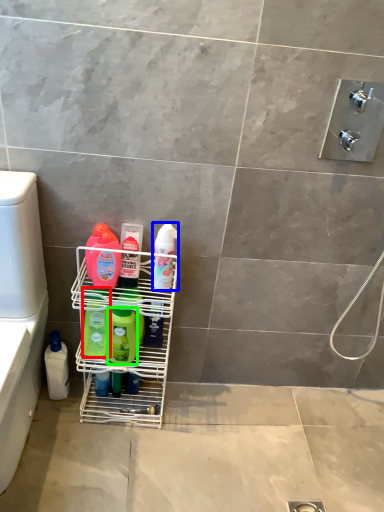
Question: Which object is positioned closest to cleaning product (highlighted by a red box)? Select from cleaning product (highlighted by a blue box) and cleaning product (highlighted by a green box).

Choices:
 (A) cleaning product
 (B) cleaning product

Answer: (B)